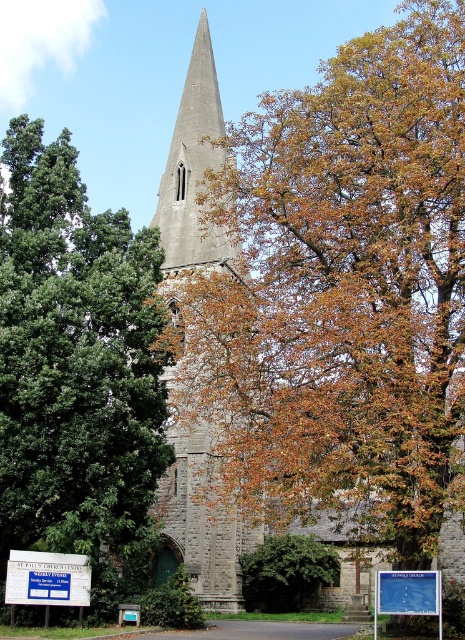
Does gray stone tower at center appear over blue plastic sign at lower center?

Correct, gray stone tower at center is located above blue plastic sign at lower center.

Is gray stone tower at center shorter than blue plastic sign at lower center?

Incorrect, gray stone tower at center's height does not fall short of blue plastic sign at lower center's.

Which is behind, point (184, 472) or point (385, 580)?

Point (184, 472)

Locate an element on the screen. gray stone tower at center is located at coordinates (199, 524).

Is green leafy tree at left smaller than blue plastic sign at lower left?

Actually, green leafy tree at left might be larger than blue plastic sign at lower left.

Can you confirm if green leafy tree at left is bigger than blue plastic sign at lower left?

Correct, green leafy tree at left is larger in size than blue plastic sign at lower left.

Image resolution: width=465 pixels, height=640 pixels. In order to click on green leafy tree at left in this screenshot , I will do `click(75, 365)`.

Which is above, green leafy tree at left or blue plastic sign at lower center?

Positioned higher is green leafy tree at left.

Which is below, green leafy tree at left or blue plastic sign at lower center?

blue plastic sign at lower center

Find the location of `green leafy tree at left`. green leafy tree at left is located at coordinates (75, 365).